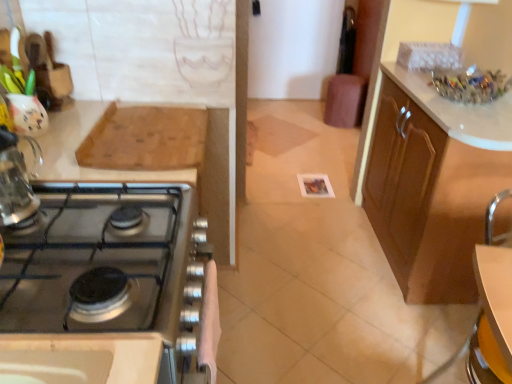
Question: Considering the positions of point (358, 99) and point (10, 321), is point (358, 99) closer or farther from the camera than point (10, 321)?

Choices:
 (A) closer
 (B) farther

Answer: (B)

Question: In the image, is brown leather bar stool at center on the left side or the right side of satin silver stove at left, the second cabinetry positioned from the right?

Choices:
 (A) left
 (B) right

Answer: (B)

Question: Which is farther from the brown wood cabinet at right, which ranks as the first cabinetry in back-to-front order?

Choices:
 (A) wooden cutting board at upper left
 (B) white glossy table at lower right
 (C) satin silver stove at left, the second cabinetry positioned from the right
 (D) clear glass kettle at left
 (E) brown leather bar stool at center

Answer: (E)

Question: Which is farther from the white glossy table at lower right?

Choices:
 (A) clear glass kettle at left
 (B) brown wood cabinet at right, positioned as the 2th cabinetry in front-to-back order
 (C) brown leather bar stool at center
 (D) satin silver stove at left, the first cabinetry positioned from the left
 (E) wooden cutting board at upper left

Answer: (C)